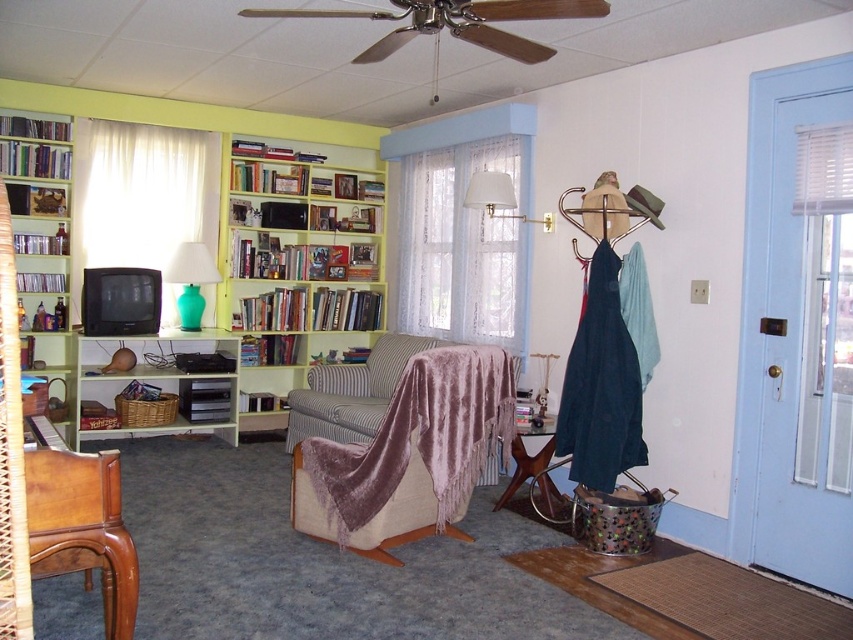
Question: Which object is farther from the camera taking this photo?

Choices:
 (A) yellow wood bookshelf at upper center
 (B) white lace curtain at center
 (C) green wooden bookshelf at left

Answer: (A)

Question: Does yellow wood bookshelf at upper center have a greater width compared to metallic coat hanger at right?

Choices:
 (A) no
 (B) yes

Answer: (B)

Question: Does velvet mauve blanket at center have a smaller size compared to green wooden bookshelf at left?

Choices:
 (A) yes
 (B) no

Answer: (B)

Question: Which object is closer to the camera taking this photo?

Choices:
 (A) yellow wood bookshelf at upper center
 (B) white lace curtain at center
 (C) teal glass lamp at center

Answer: (B)

Question: Can you confirm if white lace curtain at center is wider than green wooden bookshelf at left?

Choices:
 (A) yes
 (B) no

Answer: (A)

Question: Which object is the farthest from the velvet mauve blanket at center?

Choices:
 (A) wooden armchair at lower left
 (B) white fabric lampshade at upper center
 (C) metallic coat hanger at right
 (D) white lace curtain at center

Answer: (D)